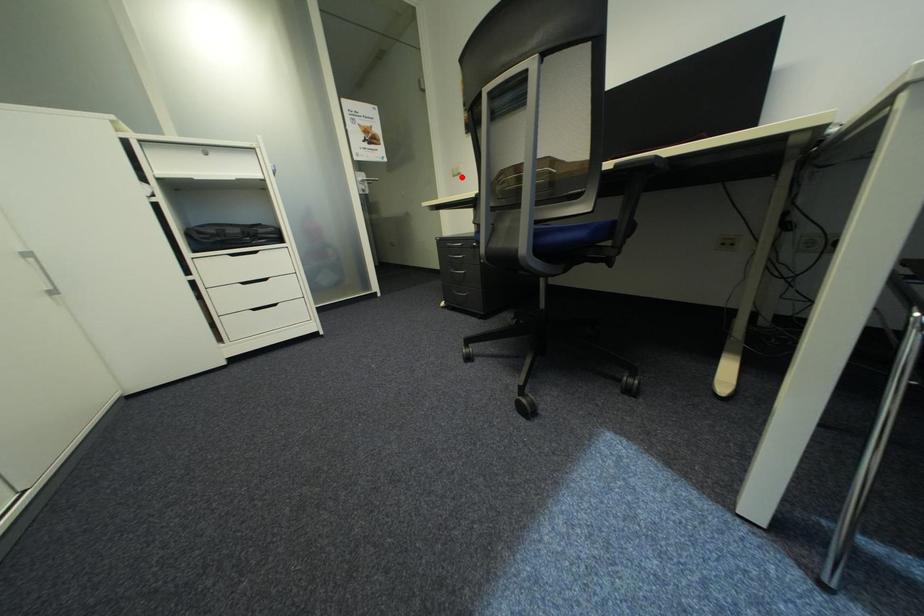
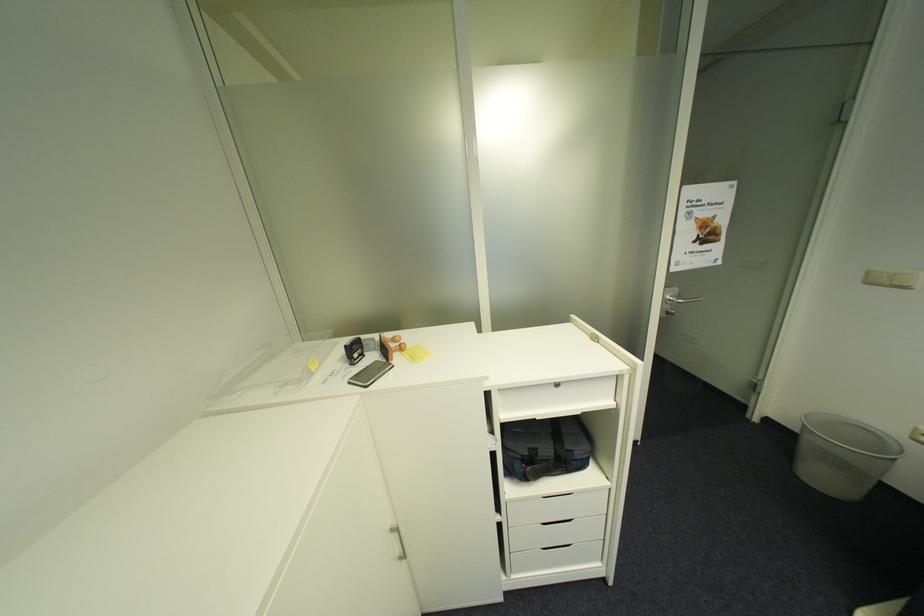
Question: I am providing you with two images of the same scene from different viewpoints. Given a red point in image1, look at the same physical point in image2. Is it:

Choices:
 (A) Closer to the viewpoint
 (B) Farther from the viewpoint

Answer: (B)